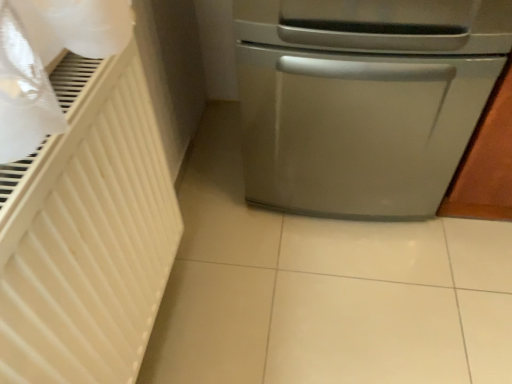
Where is `satin silver dishwasher at right`? Image resolution: width=512 pixels, height=384 pixels. satin silver dishwasher at right is located at coordinates (x=362, y=99).

This screenshot has height=384, width=512. What do you see at coordinates (362, 99) in the screenshot?
I see `satin silver dishwasher at right` at bounding box center [362, 99].

Locate an element on the screen. This screenshot has height=384, width=512. white matte radiator at left is located at coordinates (90, 240).

The width and height of the screenshot is (512, 384). Describe the element at coordinates (90, 240) in the screenshot. I see `white matte radiator at left` at that location.

Where is `satin silver dishwasher at right`? The height and width of the screenshot is (384, 512). satin silver dishwasher at right is located at coordinates (362, 99).

Which object is positioned more to the left, white matte radiator at left or satin silver dishwasher at right?

white matte radiator at left.

Is the depth of white matte radiator at left greater than that of satin silver dishwasher at right?

No, it is in front of satin silver dishwasher at right.

Is point (113, 166) closer or farther from the camera than point (319, 99)?

Point (113, 166) appears to be closer to the viewer than point (319, 99).

Consider the image. From the image's perspective, is white matte radiator at left located above or below satin silver dishwasher at right?

From the image's perspective, white matte radiator at left appears below satin silver dishwasher at right.

From a real-world perspective, is white matte radiator at left under satin silver dishwasher at right?

Actually, white matte radiator at left is physically above satin silver dishwasher at right in the real world.

Can you confirm if white matte radiator at left is thinner than satin silver dishwasher at right?

Indeed, white matte radiator at left has a lesser width compared to satin silver dishwasher at right.

Is white matte radiator at left taller than satin silver dishwasher at right?

No.

Considering the sizes of objects white matte radiator at left and satin silver dishwasher at right in the image provided, who is bigger, white matte radiator at left or satin silver dishwasher at right?

With larger size is satin silver dishwasher at right.

Is white matte radiator at left spatially inside satin silver dishwasher at right, or outside of it?

white matte radiator at left is spatially situated outside satin silver dishwasher at right.

Is white matte radiator at left directly adjacent to satin silver dishwasher at right?

No, white matte radiator at left is not next to satin silver dishwasher at right.

Is satin silver dishwasher at right at the back of white matte radiator at left?

No, white matte radiator at left is not facing the opposite direction of satin silver dishwasher at right.

At what (x,y) coordinates should I click in order to perform the action: click on home appliance above the white matte radiator at left (from the image's perspective). Please return your answer as a coordinate pair (x, y). Looking at the image, I should click on (362, 99).

Visually, is satin silver dishwasher at right positioned to the left or to the right of white matte radiator at left?

satin silver dishwasher at right is to the right of white matte radiator at left.

Considering the positions of objects satin silver dishwasher at right and white matte radiator at left in the image provided, who is behind, satin silver dishwasher at right or white matte radiator at left?

satin silver dishwasher at right is further away from the camera.

Does point (447, 49) appear closer or farther from the camera than point (128, 327)?

Point (447, 49) is positioned farther from the camera compared to point (128, 327).

From the image's perspective, which is below, satin silver dishwasher at right or white matte radiator at left?

white matte radiator at left appears lower in the image.

From a real-world perspective, is satin silver dishwasher at right positioned under white matte radiator at left based on gravity?

Yes, from a real-world perspective, satin silver dishwasher at right is beneath white matte radiator at left.

Which object is thinner, satin silver dishwasher at right or white matte radiator at left?

white matte radiator at left.

Which of these two, satin silver dishwasher at right or white matte radiator at left, stands shorter?

With less height is white matte radiator at left.

Is satin silver dishwasher at right bigger than white matte radiator at left?

Indeed, satin silver dishwasher at right has a larger size compared to white matte radiator at left.

Would you say white matte radiator at left is part of satin silver dishwasher at right's contents?

Definitely not — white matte radiator at left is not inside satin silver dishwasher at right.

Is satin silver dishwasher at right next to white matte radiator at left?

There is a gap between satin silver dishwasher at right and white matte radiator at left.

Is white matte radiator at left at the back of satin silver dishwasher at right?

That's not correct — satin silver dishwasher at right is not looking away from white matte radiator at left.

Image resolution: width=512 pixels, height=384 pixels. Identify the location of radiator positioned vertically above the satin silver dishwasher at right (from a real-world perspective). (90, 240).

The image size is (512, 384). I want to click on radiator below the satin silver dishwasher at right (from the image's perspective), so click(90, 240).

At what (x,y) coordinates should I click in order to perform the action: click on radiator located on the left of satin silver dishwasher at right. Please return your answer as a coordinate pair (x, y). The height and width of the screenshot is (384, 512). Looking at the image, I should click on (90, 240).